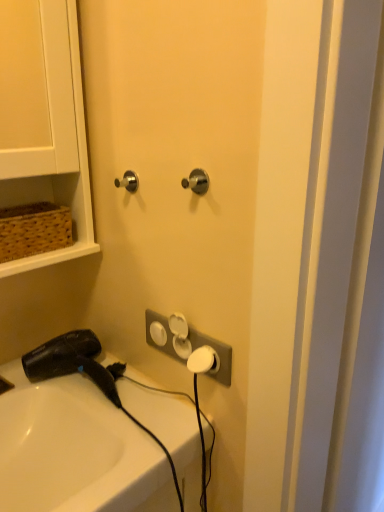
What do you see at coordinates (197, 181) in the screenshot?
I see `satin nickel knob at center, the second door handle from the left` at bounding box center [197, 181].

Where is `satin nickel knob at center, arranged as the second door handle when viewed from the back`? This screenshot has width=384, height=512. satin nickel knob at center, arranged as the second door handle when viewed from the back is located at coordinates point(197,181).

This screenshot has width=384, height=512. Describe the element at coordinates (128, 181) in the screenshot. I see `satin nickel door handle at upper left, which is the 2th door handle in right-to-left order` at that location.

Locate an element on the screen. brown woven basket at upper left is located at coordinates (58, 203).

Measure the distance from white glossy sink at lower left to black plastic hair dryer at lower left.

They are 4.51 inches apart.

From a real-world perspective, which object stands above the other?

black plastic hair dryer at lower left, from a real-world perspective.

You are a GUI agent. You are given a task and a screenshot of the screen. Output one action in this format:
    pyautogui.click(x=<x>, y=<y>)
    Task: Click on the hair drier to the right of white glossy sink at lower left
    The image size is (384, 512).
    Given the screenshot: What is the action you would take?
    pyautogui.click(x=73, y=361)

Between white glossy sink at lower left and black plastic hair dryer at lower left, which one has smaller size?

black plastic hair dryer at lower left.

Considering the relative sizes of black plastic hair dryer at lower left and satin nickel door handle at upper left, placed as the 1th door handle when sorted from left to right, in the image provided, is black plastic hair dryer at lower left wider than satin nickel door handle at upper left, placed as the 1th door handle when sorted from left to right,?

Correct, the width of black plastic hair dryer at lower left exceeds that of satin nickel door handle at upper left, placed as the 1th door handle when sorted from left to right.

From their relative heights in the image, would you say black plastic hair dryer at lower left is taller or shorter than satin nickel door handle at upper left, arranged as the 1th door handle when viewed from the back?

black plastic hair dryer at lower left is taller than satin nickel door handle at upper left, arranged as the 1th door handle when viewed from the back.

Could you tell me if black plastic hair dryer at lower left is turned towards satin nickel door handle at upper left, placed as the 1th door handle when sorted from left to right?

No.

From a real-world perspective, which is physically above, black plastic hair dryer at lower left or satin nickel door handle at upper left, the second door handle in the front-to-back sequence?

satin nickel door handle at upper left, the second door handle in the front-to-back sequence.

Is brown woven basket at upper left not inside satin nickel knob at center, arranged as the second door handle when viewed from the back?

Yes, brown woven basket at upper left is outside of satin nickel knob at center, arranged as the second door handle when viewed from the back.

Is brown woven basket at upper left not near satin nickel knob at center, the 1th door handle from the front?

No, brown woven basket at upper left is not far from satin nickel knob at center, the 1th door handle from the front.

Where is `the 2nd door handle located above the brown woven basket at upper left (from a real-world perspective)`? Image resolution: width=384 pixels, height=512 pixels. the 2nd door handle located above the brown woven basket at upper left (from a real-world perspective) is located at coordinates (197, 181).

Which is more to the left, brown woven basket at upper left or satin nickel knob at center, the 1th door handle from the front?

Positioned to the left is brown woven basket at upper left.

Would you say satin nickel knob at center, the 1th door handle from the front, is to the left or to the right of black plastic hair dryer at lower left in the picture?

Based on their positions, satin nickel knob at center, the 1th door handle from the front, is located to the right of black plastic hair dryer at lower left.

How distant is satin nickel knob at center, arranged as the second door handle when viewed from the back, from black plastic hair dryer at lower left?

19.53 inches.

From a real-world perspective, does satin nickel knob at center, the second door handle from the left, sit lower than black plastic hair dryer at lower left?

No, from a real-world perspective, satin nickel knob at center, the second door handle from the left, is not under black plastic hair dryer at lower left.

Is satin nickel knob at center, acting as the first door handle starting from the right, looking in the opposite direction of black plastic hair dryer at lower left?

No.

Is white plastic electric outlet at center behind satin nickel knob at center, arranged as the second door handle when viewed from the back?

Yes, white plastic electric outlet at center is further from the viewer.

Consider the image. From a real-world perspective, is white plastic electric outlet at center above or below satin nickel knob at center, the 1th door handle from the front?

In terms of real-world spatial position, white plastic electric outlet at center is below satin nickel knob at center, the 1th door handle from the front.

Locate an element on the screen. Image resolution: width=384 pixels, height=512 pixels. door handle on the right of the white plastic electric outlet at center is located at coordinates (197, 181).

Looking at this image, could you tell me if white plastic electric outlet at center is facing satin nickel knob at center, arranged as the second door handle when viewed from the back?

No, white plastic electric outlet at center is not oriented towards satin nickel knob at center, arranged as the second door handle when viewed from the back.

Considering the relative positions of brown woven basket at upper left and white glossy sink at lower left in the image provided, is brown woven basket at upper left to the left of white glossy sink at lower left from the viewer's perspective?

Yes, brown woven basket at upper left is to the left of white glossy sink at lower left.

How different are the orientations of brown woven basket at upper left and white glossy sink at lower left in degrees?

They differ by 1.3 degrees in their facing directions.

Is brown woven basket at upper left taller than white glossy sink at lower left?

Incorrect, the height of brown woven basket at upper left is not larger of that of white glossy sink at lower left.

From a real-world perspective, is brown woven basket at upper left physically below white glossy sink at lower left?

No.

Which of these two, white plastic electric outlet at center or white glossy sink at lower left, stands shorter?

white plastic electric outlet at center is shorter.

Is white plastic electric outlet at center located outside white glossy sink at lower left?

Yes, white plastic electric outlet at center is located beyond the bounds of white glossy sink at lower left.

Is white plastic electric outlet at center in front of or behind white glossy sink at lower left in the image?

white plastic electric outlet at center is positioned farther from the viewer than white glossy sink at lower left.

From the image's perspective, which object appears higher, white plastic electric outlet at center or white glossy sink at lower left?

white plastic electric outlet at center appears higher in the image.

Locate an element on the screen. sink below the black plastic hair dryer at lower left (from a real-world perspective) is located at coordinates (49, 450).

At what (x,y) coordinates should I click in order to perform the action: click on hair drier below the satin nickel door handle at upper left, which is the 2th door handle in right-to-left order (from the image's perspective). Please return your answer as a coordinate pair (x, y). Looking at the image, I should click on (73, 361).

Estimate the real-world distances between objects in this image. Which object is closer to satin nickel knob at center, arranged as the second door handle when viewed from the back, white plastic electric outlet at center or white glossy sink at lower left?

white plastic electric outlet at center.

Considering their positions, is white plastic electric outlet at center positioned further to brown woven basket at upper left than satin nickel knob at center, acting as the first door handle starting from the right?

The object further to brown woven basket at upper left is satin nickel knob at center, acting as the first door handle starting from the right.

Consider the image. Which object lies nearer to the anchor point black plastic hair dryer at lower left, brown woven basket at upper left or white glossy sink at lower left?

white glossy sink at lower left is closer to black plastic hair dryer at lower left.

Estimate the real-world distances between objects in this image. Which object is closer to satin nickel door handle at upper left, the second door handle in the front-to-back sequence, black plastic hair dryer at lower left or white plastic electric outlet at center?

Based on the image, white plastic electric outlet at center appears to be nearer to satin nickel door handle at upper left, the second door handle in the front-to-back sequence.

From the picture: Based on their spatial positions, is white plastic electric outlet at center or black plastic hair dryer at lower left closer to white glossy sink at lower left?

black plastic hair dryer at lower left.

Estimate the real-world distances between objects in this image. Which object is further from satin nickel knob at center, acting as the first door handle starting from the right, white glossy sink at lower left or satin nickel door handle at upper left, the second door handle in the front-to-back sequence?

Among the two, white glossy sink at lower left is located further to satin nickel knob at center, acting as the first door handle starting from the right.

From the image, which object appears to be farther from white plastic electric outlet at center, brown woven basket at upper left or satin nickel door handle at upper left, placed as the 1th door handle when sorted from left to right?

Among the two, satin nickel door handle at upper left, placed as the 1th door handle when sorted from left to right, is located further to white plastic electric outlet at center.

Which object lies further to the anchor point satin nickel knob at center, arranged as the second door handle when viewed from the back, satin nickel door handle at upper left, placed as the 1th door handle when sorted from left to right, or brown woven basket at upper left?

The object further to satin nickel knob at center, arranged as the second door handle when viewed from the back, is brown woven basket at upper left.

At what (x,y) coordinates should I click in order to perform the action: click on hair drier between brown woven basket at upper left and white plastic electric outlet at center from left to right. Please return your answer as a coordinate pair (x, y). The height and width of the screenshot is (512, 384). Looking at the image, I should click on (73, 361).

Identify the location of electric outlet that lies between satin nickel knob at center, the second door handle from the left, and white glossy sink at lower left from top to bottom. This screenshot has width=384, height=512. (188, 345).

This screenshot has height=512, width=384. In order to click on hair drier between white glossy sink at lower left and white plastic electric outlet at center in the horizontal direction in this screenshot , I will do `click(73, 361)`.

Image resolution: width=384 pixels, height=512 pixels. In order to click on shelf between satin nickel knob at center, the second door handle from the left, and white glossy sink at lower left, in the vertical direction in this screenshot , I will do `click(58, 203)`.